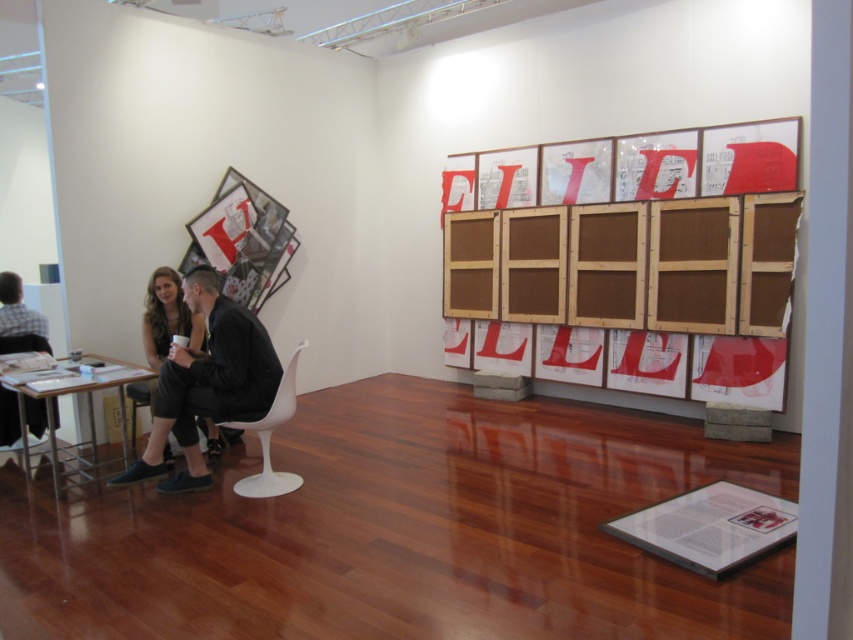
Is wooden framed artwork at upper right wider than metallic silver table at lower left?

Correct, the width of wooden framed artwork at upper right exceeds that of metallic silver table at lower left.

Which is in front, point (740, 324) or point (125, 404)?

Point (125, 404)

Find the location of a particular element. Image resolution: width=853 pixels, height=640 pixels. wooden framed artwork at upper right is located at coordinates (634, 234).

Is black leather jacket at left below metallic silver table at lower left?

Incorrect, black leather jacket at left is not positioned below metallic silver table at lower left.

Can you confirm if black leather jacket at left is shorter than metallic silver table at lower left?

In fact, black leather jacket at left may be taller than metallic silver table at lower left.

This screenshot has height=640, width=853. Identify the location of black leather jacket at left. (207, 384).

Where is `black leather jacket at left`? The height and width of the screenshot is (640, 853). black leather jacket at left is located at coordinates (207, 384).

Who is positioned more to the left, white plastic chair at center or white plastic chair at left?

From the viewer's perspective, white plastic chair at left appears more on the left side.

Is white plastic chair at center further to camera compared to white plastic chair at left?

That is False.

Describe the element at coordinates (270, 438) in the screenshot. I see `white plastic chair at center` at that location.

Where is `white plastic chair at center`? white plastic chair at center is located at coordinates (270, 438).